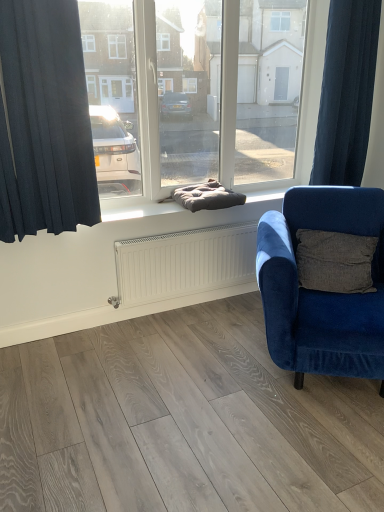
The width and height of the screenshot is (384, 512). I want to click on vacant region to the left of velvet blue armchair at right, so click(x=186, y=362).